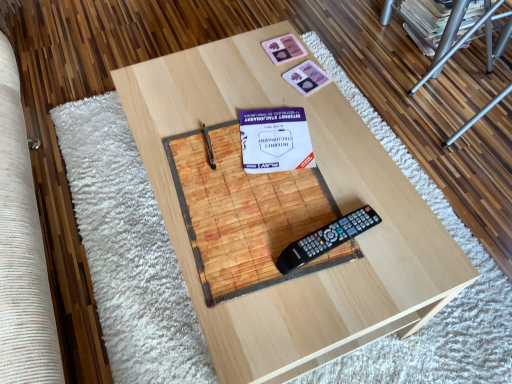
This screenshot has width=512, height=384. Identify the location of vacant space behind black plastic remote control at center. (326, 183).